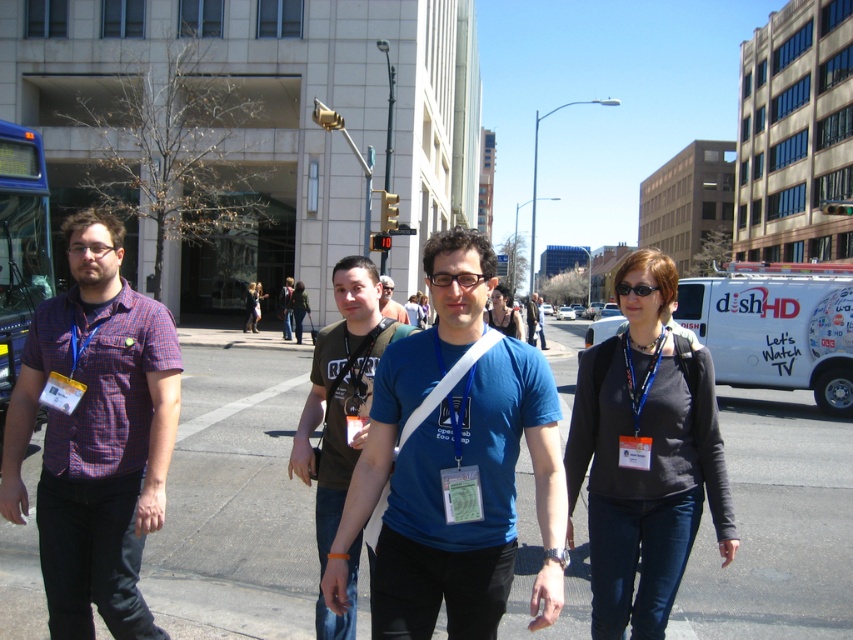
You are a photographer standing on the sidewalk trying to capture a clear shot of the dark gray sweater at center without the gray asphalt pavement at center appearing in the frame. Is this possible given their positions?

The gray asphalt pavement at center is positioned under the dark gray sweater at center, so it would be difficult to capture the sweater without the pavement appearing in the frame since they are in close proximity.

You are a delivery person who needs to cross the gray asphalt pavement at center to reach the blue glass bus at left. The city has a rule that pedestrians must stay at least 4 meters away from any vehicle. Is it safe for you to proceed?

The gray asphalt pavement at center and blue glass bus at left are 3.78 meters apart from each other. Since the required distance is 4 meters, the current gap is insufficient. You should not proceed and must find another path or wait until the bus moves to maintain safety regulations.